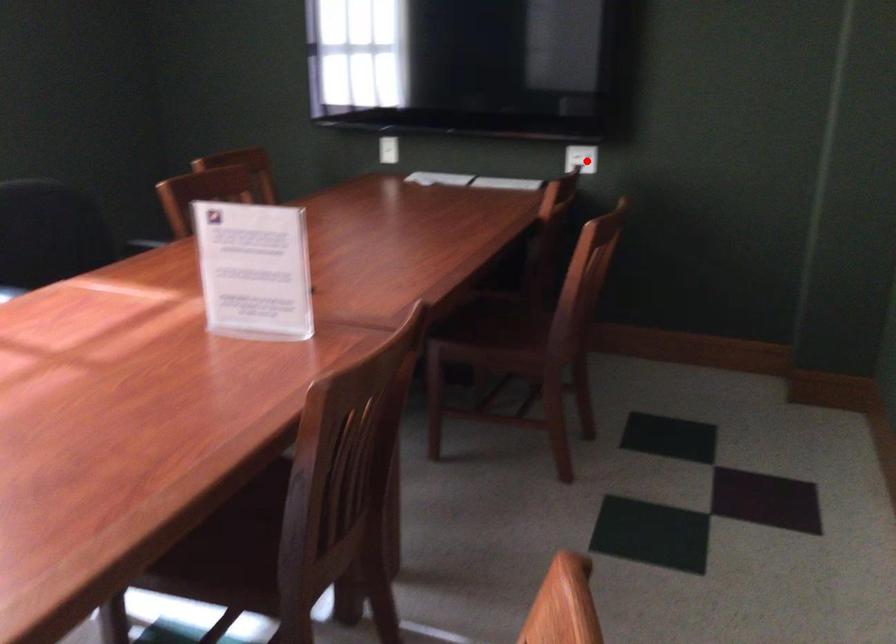
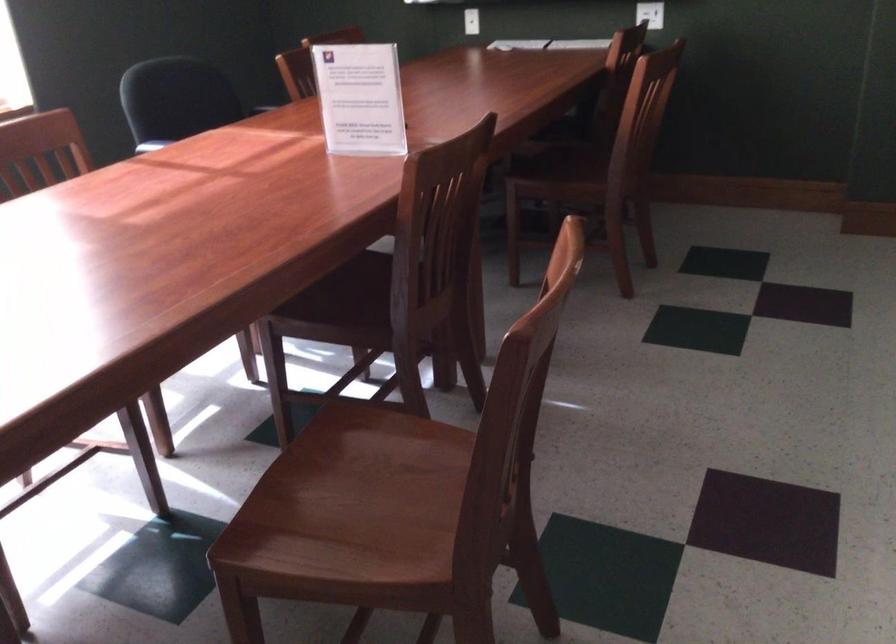
The point at the highlighted location is marked in the first image. Where is the corresponding point in the second image?

(650, 14)